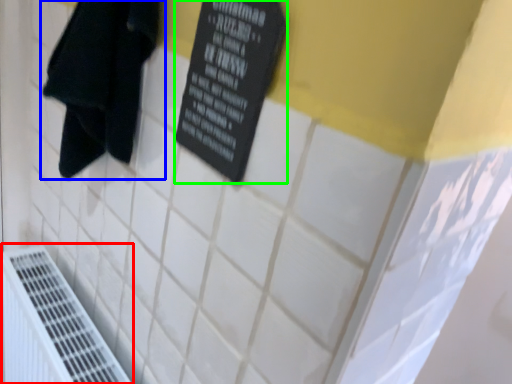
Question: Based on their relative distances, which object is nearer to air conditioning (highlighted by a red box)? Choose from towel (highlighted by a blue box) and bulletin board (highlighted by a green box).

Choices:
 (A) towel
 (B) bulletin board

Answer: (A)